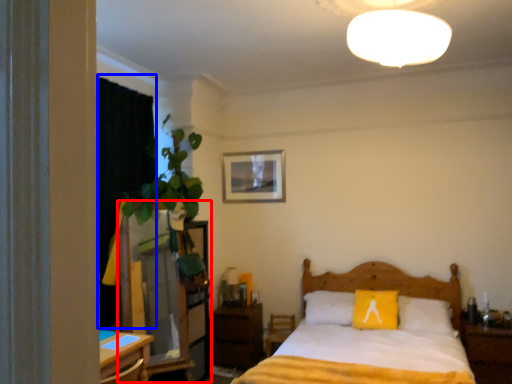
Question: Which point is closer to the camera, dresser (highlighted by a red box) or curtain (highlighted by a blue box)?

Choices:
 (A) dresser
 (B) curtain

Answer: (A)